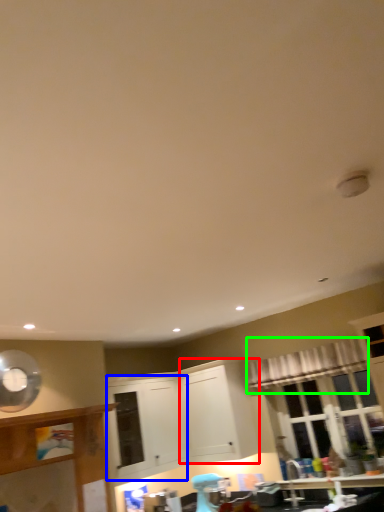
Question: Based on their relative distances, which object is nearer to cabinetry (highlighted by a red box)? Choose from cabinetry (highlighted by a blue box) and curtain (highlighted by a green box).

Choices:
 (A) cabinetry
 (B) curtain

Answer: (A)